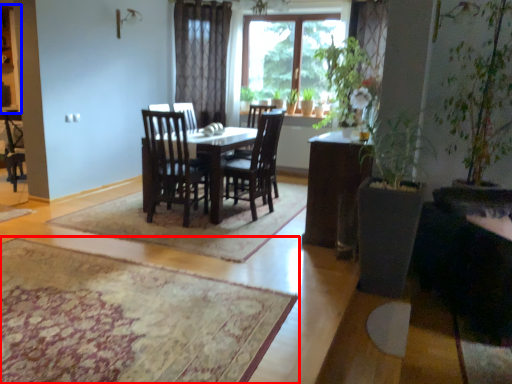
Question: Which of the following is the farthest to the observer, mat (highlighted by a red box) or cabinetry (highlighted by a blue box)?

Choices:
 (A) mat
 (B) cabinetry

Answer: (B)